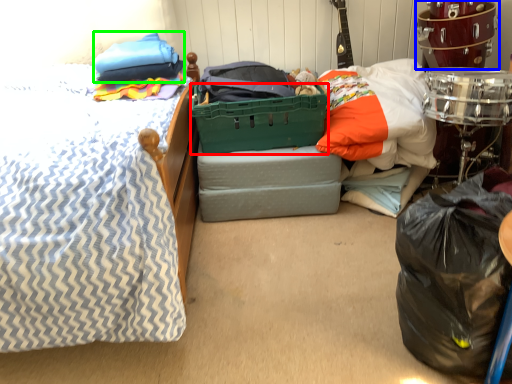
Question: Estimate the real-world distances between objects in this image. Which object is farther from basket (highlighted by a red box), drum (highlighted by a blue box) or pillow (highlighted by a green box)?

Choices:
 (A) drum
 (B) pillow

Answer: (A)